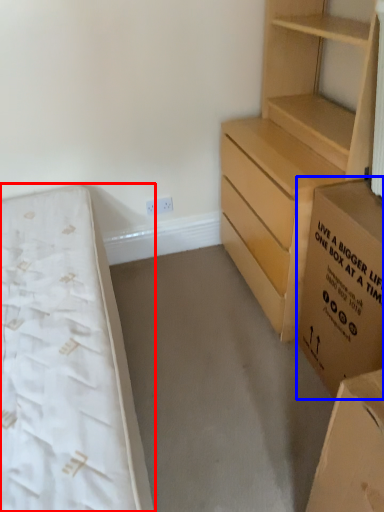
Question: Which object appears closest to the camera in this image, bed (highlighted by a red box) or cardboard box (highlighted by a blue box)?

Choices:
 (A) bed
 (B) cardboard box

Answer: (A)